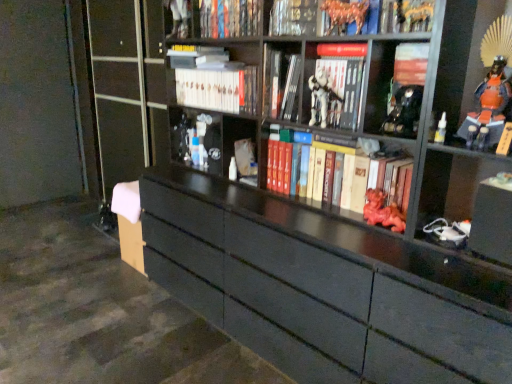
Question: Is white plastic figure at center located outside translucent plastic bottle at upper right, which is the fifth toy from back to front?

Choices:
 (A) yes
 (B) no

Answer: (A)

Question: Does white plastic figure at center have a lesser width compared to translucent plastic bottle at upper right, which is the fifth toy from back to front?

Choices:
 (A) yes
 (B) no

Answer: (B)

Question: Is white plastic figure at center facing away from translucent plastic bottle at upper right, which is the fifth toy from back to front?

Choices:
 (A) yes
 (B) no

Answer: (B)

Question: Are white plastic figure at center and translucent plastic bottle at upper right, the first toy viewed from the right, making contact?

Choices:
 (A) no
 (B) yes

Answer: (A)

Question: Is translucent plastic bottle at upper right, the 2th toy when ordered from front to back, surrounded by white plastic figure at center?

Choices:
 (A) yes
 (B) no

Answer: (B)

Question: Considering the positions of point (306, 362) and point (350, 3), is point (306, 362) closer or farther from the camera than point (350, 3)?

Choices:
 (A) closer
 (B) farther

Answer: (B)

Question: Considering the positions of matte black bookcase at center and metallic gold horse at upper center, which ranks as the third toy in left-to-right order, in the image, is matte black bookcase at center taller or shorter than metallic gold horse at upper center, which ranks as the third toy in left-to-right order,?

Choices:
 (A) tall
 (B) short

Answer: (A)

Question: Based on their positions, is matte black bookcase at center located to the left or right of metallic gold horse at upper center, the 4th toy viewed from the back?

Choices:
 (A) left
 (B) right

Answer: (A)

Question: From a real-world perspective, is matte black bookcase at center above or below metallic gold horse at upper center, which ranks as the third toy in left-to-right order?

Choices:
 (A) above
 (B) below

Answer: (B)

Question: Do you think white matte book at center, arranged as the sixth book when viewed from the top, is within orange glossy samurai armor at upper right, or outside of it?

Choices:
 (A) inside
 (B) outside

Answer: (B)

Question: In the image, is white matte book at center, arranged as the sixth book when viewed from the top, on the left side or the right side of orange glossy samurai armor at upper right?

Choices:
 (A) right
 (B) left

Answer: (B)

Question: Is white matte book at center, which appears as the 3th book when ordered from the bottom, taller or shorter than orange glossy samurai armor at upper right?

Choices:
 (A) tall
 (B) short

Answer: (B)

Question: Based on their sizes in the image, would you say white matte book at center, arranged as the sixth book when viewed from the top, is bigger or smaller than orange glossy samurai armor at upper right?

Choices:
 (A) small
 (B) big

Answer: (A)

Question: Is point (240, 18) positioned closer to the camera than point (294, 94)?

Choices:
 (A) farther
 (B) closer

Answer: (A)

Question: Would you say hardcover book at upper center, marked as the 8th book in a bottom-to-top arrangement, is inside or outside hardcover book at center, the fifth book from the top?

Choices:
 (A) outside
 (B) inside

Answer: (A)